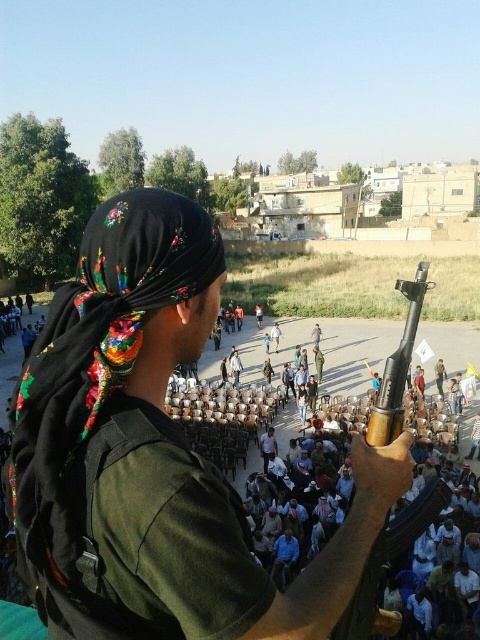
Is white cotton chairs at center taller than black embroidered headscarf at upper left?

Yes.

How distant is white cotton chairs at center from black embroidered headscarf at upper left?

The distance of white cotton chairs at center from black embroidered headscarf at upper left is 41.53 feet.

Find the location of a particular element. white cotton chairs at center is located at coordinates (207, 502).